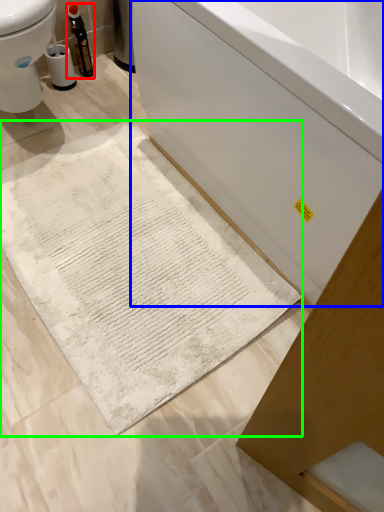
Question: Estimate the real-world distances between objects in this image. Which object is closer to bottle (highlighted by a red box), bathtub (highlighted by a blue box) or bath mat (highlighted by a green box)?

Choices:
 (A) bathtub
 (B) bath mat

Answer: (B)